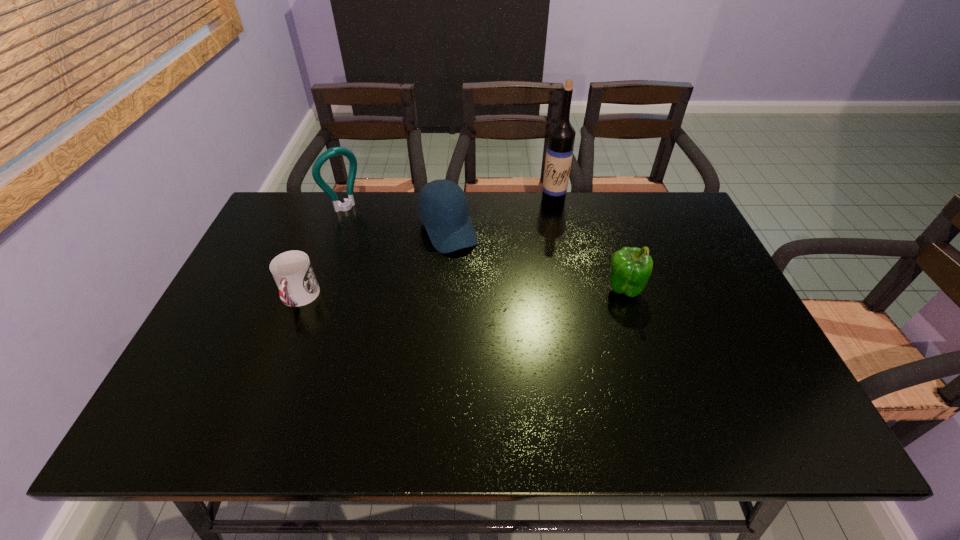
This screenshot has width=960, height=540. I want to click on free space located 0.160m on the label of the tallest object, so click(528, 234).

This screenshot has width=960, height=540. I want to click on vacant space situated on the label of the tallest object, so click(x=540, y=218).

Find the location of a particular element. The width and height of the screenshot is (960, 540). blank space located on the label of the tallest object is located at coordinates (525, 238).

This screenshot has width=960, height=540. I want to click on vacant space located 0.310m on the front-facing side of the second shortest object, so click(502, 332).

You are a GUI agent. You are given a task and a screenshot of the screen. Output one action in this format:
    pyautogui.click(x=<x>, y=<y>)
    Task: Click on the free space located 0.390m on the front-facing side of the second shortest object
    The image size is (960, 540).
    Given the screenshot: What is the action you would take?
    pyautogui.click(x=516, y=357)

Identify the location of vacant space situated on the front-facing side of the second shortest object. (504, 335).

Locate an element on the screen. free space located 0.250m at the jaws of the bottle opener is located at coordinates (394, 256).

Identify the location of free space located 0.150m at the jaws of the bottle opener. The height and width of the screenshot is (540, 960). (376, 239).

This screenshot has height=540, width=960. What are the coordinates of `free location located at the jaws of the bottle opener` in the screenshot? It's located at (385, 247).

This screenshot has height=540, width=960. Find the location of `wine bottle that is positioned at the far edge`. wine bottle that is positioned at the far edge is located at coordinates (559, 152).